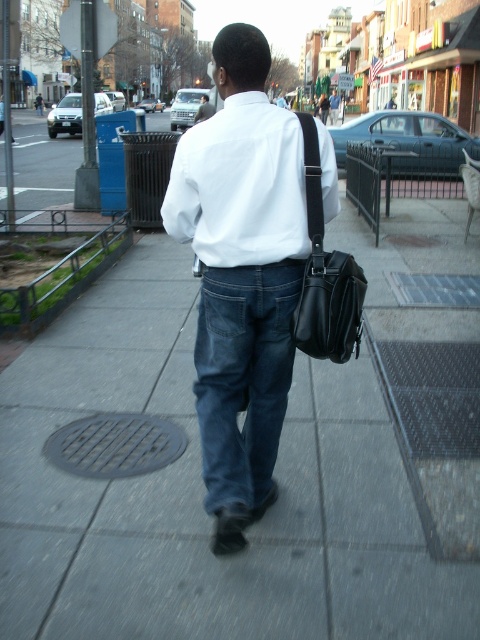
Question: Which object is the farthest from the matte white shirt at center?

Choices:
 (A) silver metallic manhole cover at lower center
 (B) denim pocket at center

Answer: (B)

Question: Among these objects, which one is nearest to the camera?

Choices:
 (A) white matte shirt at center
 (B) gray concrete sidewalk at center

Answer: (B)

Question: Among these points, which one is nearest to the camera?

Choices:
 (A) (241, 300)
 (B) (159, 420)
 (C) (279, 420)

Answer: (A)

Question: Observing the image, what is the correct spatial positioning of gray concrete sidewalk at center in reference to dark blue denim jeans at center?

Choices:
 (A) below
 (B) above

Answer: (A)

Question: Is black leather messenger bag at center bigger than silver metallic manhole cover at lower center?

Choices:
 (A) no
 (B) yes

Answer: (B)

Question: Is black leather messenger bag at center below denim pocket at center?

Choices:
 (A) yes
 (B) no

Answer: (B)